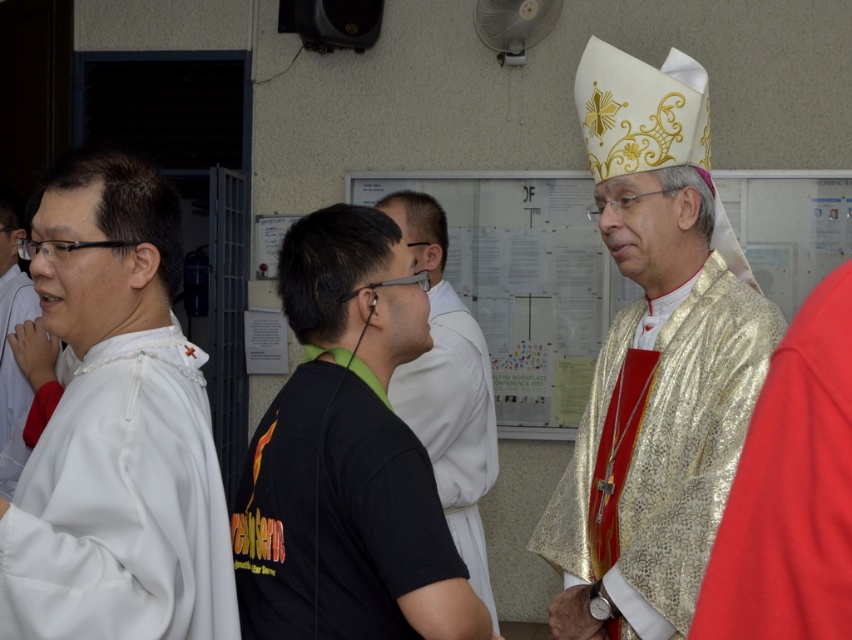
You are standing in the formal religious setting depicted in the scene. There is a point marked at coordinates [116,428]. What object is located at this point?

The point at coordinates [116,428] corresponds to the white matte robe at left.